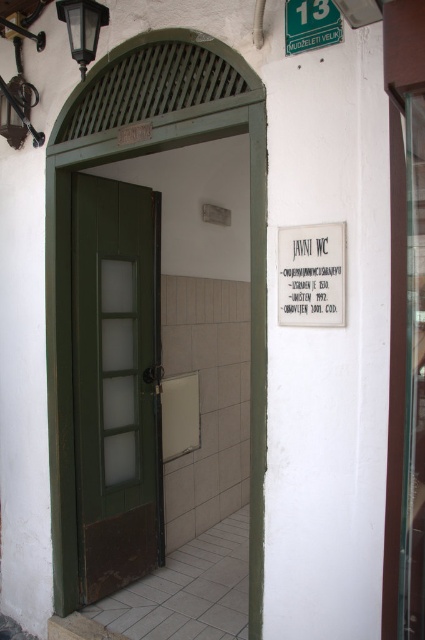
Who is more distant from viewer, [108,417] or [302,29]?

The point [108,417] is behind.

Does green wood door at center have a lesser width compared to green plastic sign at upper center?

Incorrect, green wood door at center's width is not less than green plastic sign at upper center's.

Does point (96, 496) lie behind point (320, 26)?

Yes, it is behind point (320, 26).

You are a GUI agent. You are given a task and a screenshot of the screen. Output one action in this format:
    pyautogui.click(x=<x>, y=<y>)
    Task: Click on the green wood door at center
    This screenshot has width=425, height=640.
    Given the screenshot: What is the action you would take?
    tap(116, 381)

Can you confirm if green matte door at center is positioned to the left of green plastic sign at upper center?

Indeed, green matte door at center is positioned on the left side of green plastic sign at upper center.

Is green matte door at center positioned in front of green plastic sign at upper center?

That is False.

What do you see at coordinates (70, 332) in the screenshot? I see `green matte door at center` at bounding box center [70, 332].

Find the location of a particular element. The image size is (425, 640). green matte door at center is located at coordinates (70, 332).

Is green wood door at center to the left of white paper sign at center from the viewer's perspective?

Yes, green wood door at center is to the left of white paper sign at center.

Is green wood door at center in front of white paper sign at center?

No, it is not.

Is point (96, 221) in front of point (317, 232)?

No.

Locate an element on the screen. green wood door at center is located at coordinates (116, 381).